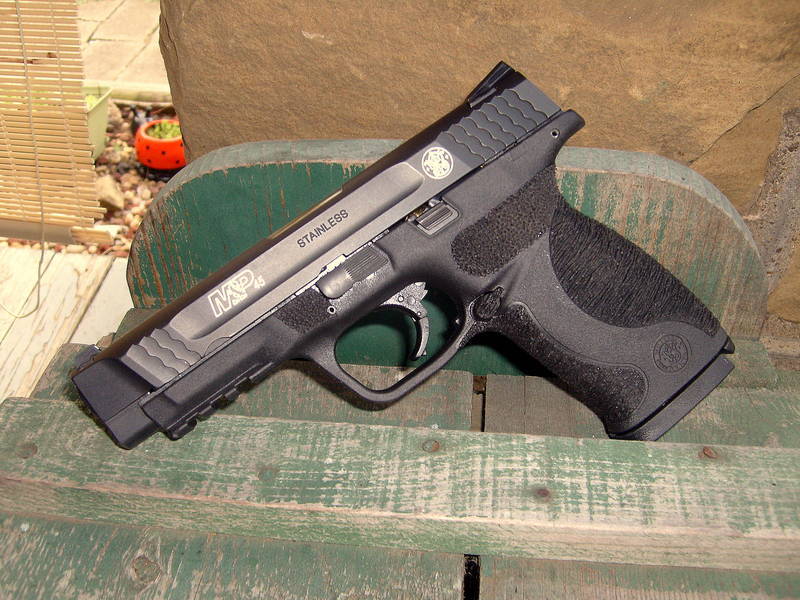
In order to click on flower pot in this screenshot , I will do `click(158, 155)`, `click(102, 113)`, `click(32, 137)`.